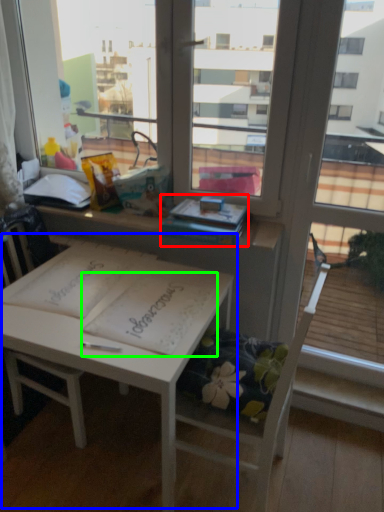
Question: Which is nearer to the book (highlighted by a red box)? table (highlighted by a blue box) or notebook (highlighted by a green box).

Choices:
 (A) table
 (B) notebook

Answer: (B)